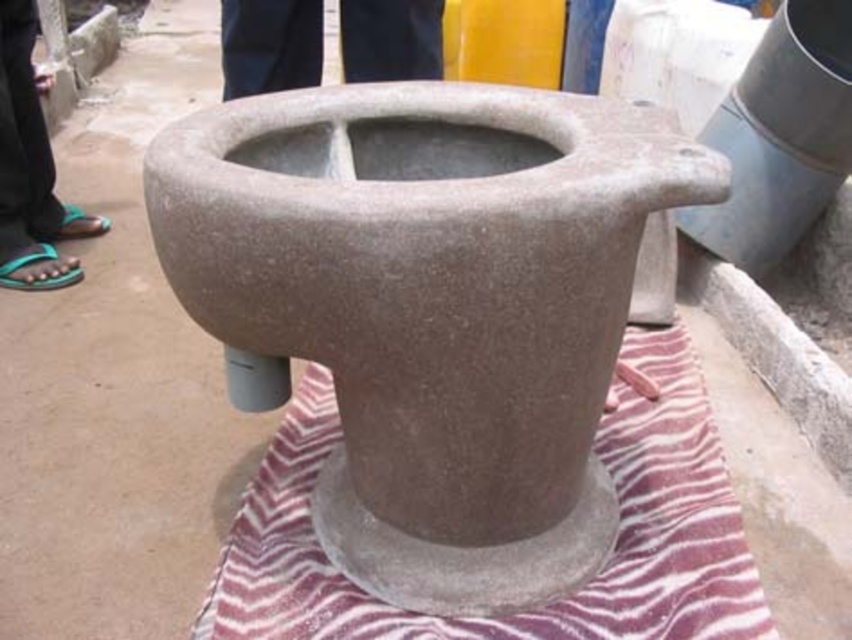
Is striped fabric mat at center smaller than green flip-flops at lower left?

No.

Looking at this image, who is shorter, striped fabric mat at center or green flip-flops at lower left?

striped fabric mat at center

You are a GUI agent. You are given a task and a screenshot of the screen. Output one action in this format:
    pyautogui.click(x=<x>, y=<y>)
    Task: Click on the striped fabric mat at center
    The width and height of the screenshot is (852, 640).
    Given the screenshot: What is the action you would take?
    pyautogui.click(x=540, y=608)

Can you confirm if dark blue pants at upper center is smaller than green flip-flops at lower left?

Indeed, dark blue pants at upper center has a smaller size compared to green flip-flops at lower left.

Which is behind, point (271, 17) or point (43, 184)?

Point (43, 184)

What do you see at coordinates (269, 45) in the screenshot? The width and height of the screenshot is (852, 640). I see `dark blue pants at upper center` at bounding box center [269, 45].

At what (x,y) coordinates should I click in order to perform the action: click on dark blue pants at upper center. Please return your answer as a coordinate pair (x, y). This screenshot has width=852, height=640. Looking at the image, I should click on (269, 45).

This screenshot has height=640, width=852. In order to click on striped fabric mat at center in this screenshot , I will do `click(540, 608)`.

Who is more forward, (694, 464) or (283, 24)?

Point (694, 464) is in front.

In order to click on striped fabric mat at center in this screenshot , I will do `click(540, 608)`.

I want to click on striped fabric mat at center, so click(x=540, y=608).